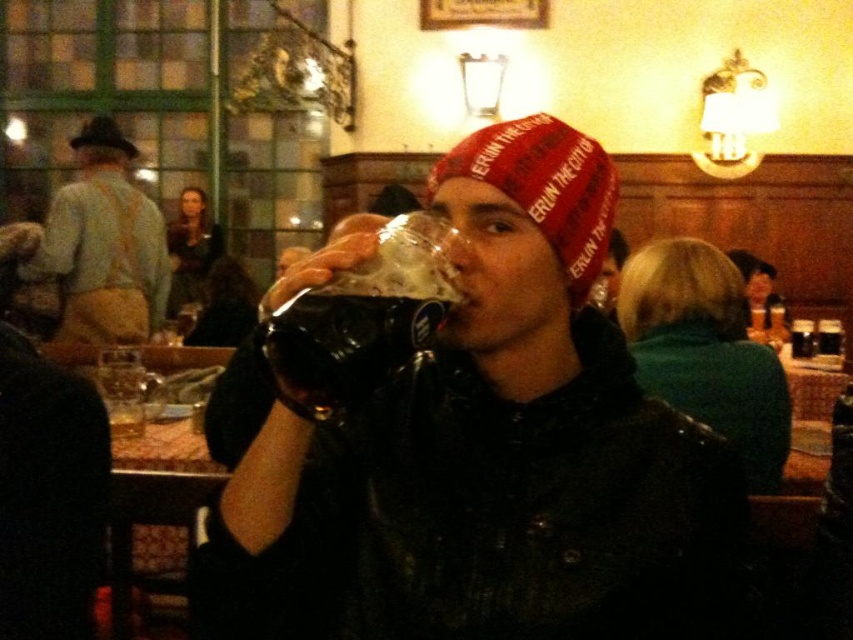
Between light brown leather jacket at upper left and black felt hat at upper left, which one has less height?

black felt hat at upper left is shorter.

This screenshot has width=853, height=640. What do you see at coordinates (103, 244) in the screenshot?
I see `light brown leather jacket at upper left` at bounding box center [103, 244].

Is point (114, 228) closer to camera compared to point (132, 156)?

Yes, point (114, 228) is in front of point (132, 156).

The image size is (853, 640). I want to click on light brown leather jacket at upper left, so pyautogui.click(x=103, y=244).

Consider the image. Which is below, translucent glass beer at center or black felt hat at upper left?

translucent glass beer at center is lower down.

Measure the distance between translucent glass beer at center and camera.

The distance of translucent glass beer at center from camera is 82.73 centimeters.

You are a GUI agent. You are given a task and a screenshot of the screen. Output one action in this format:
    pyautogui.click(x=<x>, y=<y>)
    Task: Click on the translucent glass beer at center
    
    Given the screenshot: What is the action you would take?
    pyautogui.click(x=347, y=340)

Can you confirm if light brown leather jacket at upper left is positioned to the right of translucent glass beer at center?

In fact, light brown leather jacket at upper left is to the left of translucent glass beer at center.

Between light brown leather jacket at upper left and translucent glass beer at center, which one is positioned lower?

translucent glass beer at center is lower down.

Which is in front, point (154, 282) or point (432, 289)?

Positioned in front is point (432, 289).

At what (x,y) coordinates should I click in order to perform the action: click on light brown leather jacket at upper left. Please return your answer as a coordinate pair (x, y). This screenshot has width=853, height=640. Looking at the image, I should click on (103, 244).